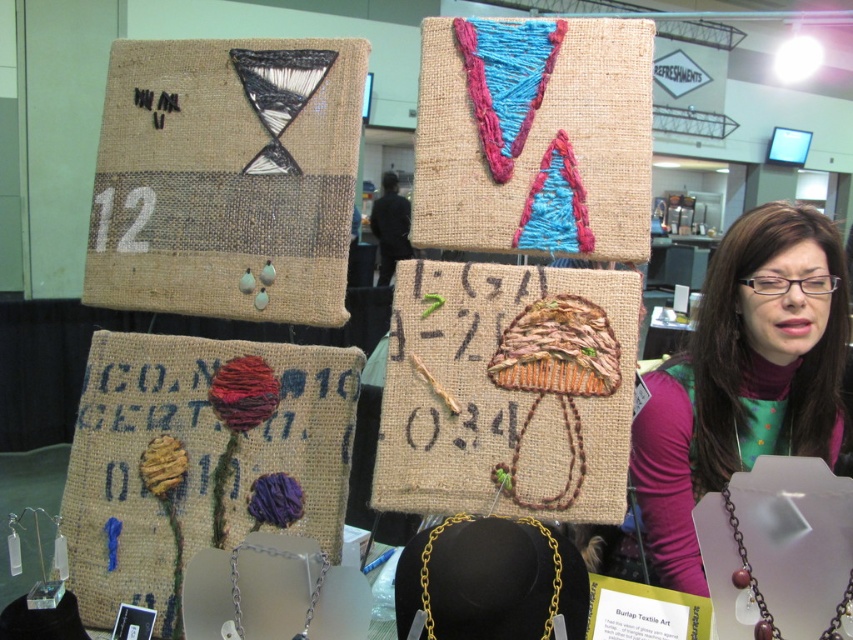
You are a customer at the craft fair who wants to examine the matte black necklace at lower right closely. You are currently standing 1.27 meters away from it. Can you lean forward to get a closer look without moving your feet?

The matte black necklace at lower right is 1.27 meters away from the viewer. Since leaning forward typically allows reaching about 0.5 meters closer, you would still be 0.77 meters away. Therefore, you cannot get close enough to examine it without moving closer.

You are an art collector examining the textile art display. You notice the matte black necklace at lower right and the black fabric person at center. Which object is positioned closer to you?

The matte black necklace at lower right is closer to the viewer than the black fabric person at center.